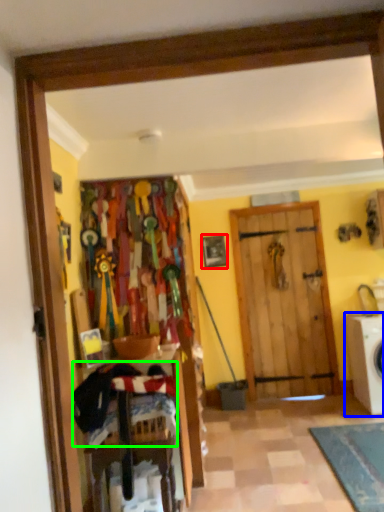
Question: Estimate the real-world distances between objects in this image. Which object is closer to picture frame (highlighted by a red box), washing machine (highlighted by a blue box) or laundry (highlighted by a green box)?

Choices:
 (A) washing machine
 (B) laundry

Answer: (A)